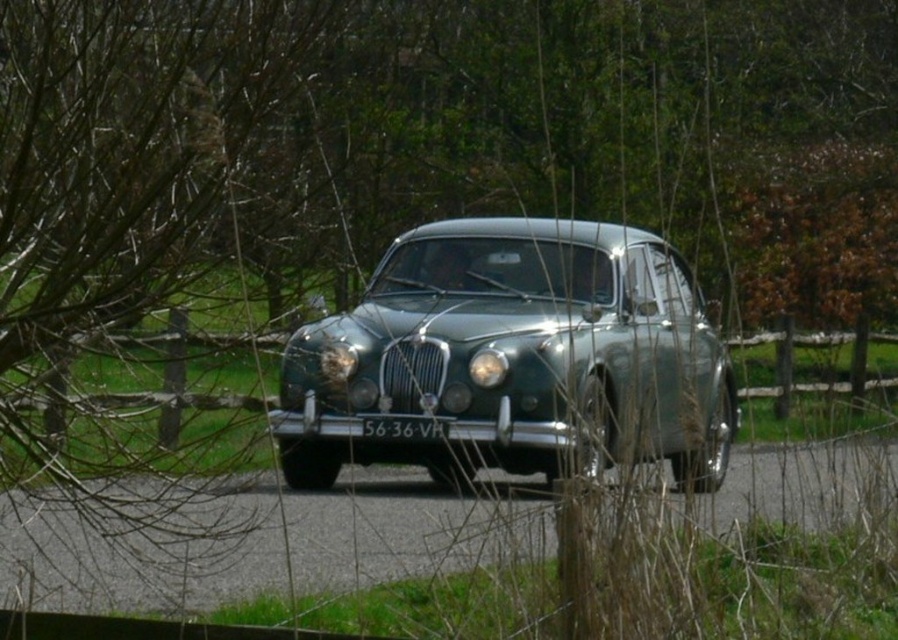
You are a photographer positioned at the camera. You want to take a photo of the vintage car and need to focus on two specific points. The first point is point (364, 428) and the second is point (500, 374). Which point should you focus on first to ensure the car is sharp in the photo?

You should focus on point (364, 428) first because it is closer to the camera than point (500, 374), ensuring the car appears sharp in the photo.

You are a photographer trying to capture a clear photo of the white plastic license plate at center from your position. Considering the distance between you and the license plate, would you need to adjust your camera focus to ensure clarity?

The distance between the white plastic license plate at center and the camera is 10.86 meters. To capture a clear photo, you should adjust your camera focus to this distance.